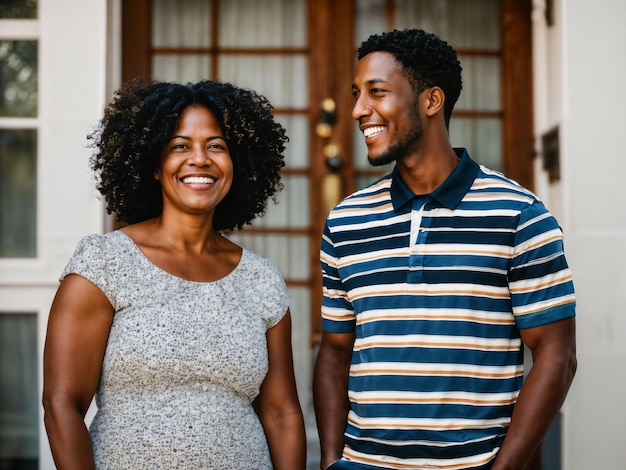
You are a GUI agent. You are given a task and a screenshot of the screen. Output one action in this format:
    pyautogui.click(x=<x>, y=<y>)
    Task: Click on the windows
    The height and width of the screenshot is (470, 626).
    Given the screenshot: What is the action you would take?
    pyautogui.click(x=21, y=194), pyautogui.click(x=21, y=322)